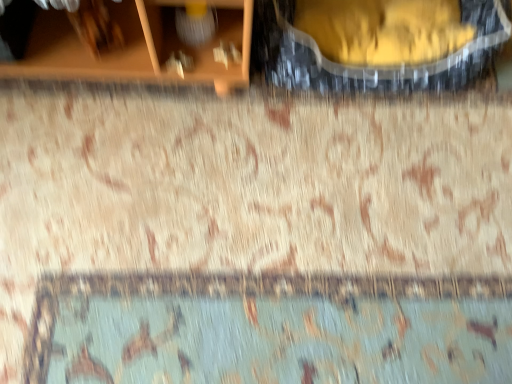
Locate an element on the screen. The image size is (512, 384). wooden shelf at upper left is located at coordinates (137, 46).

This screenshot has width=512, height=384. What do you see at coordinates (137, 46) in the screenshot?
I see `wooden shelf at upper left` at bounding box center [137, 46].

In order to click on wooden shelf at upper left in this screenshot , I will do `click(137, 46)`.